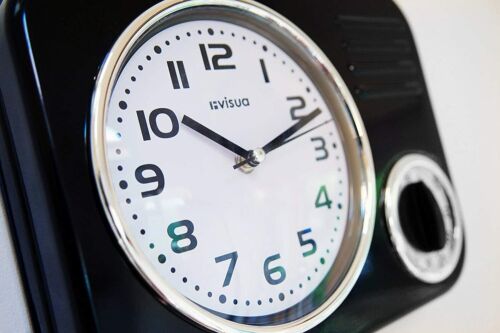
Image resolution: width=500 pixels, height=333 pixels. I want to click on silver frame, so click(x=433, y=277).